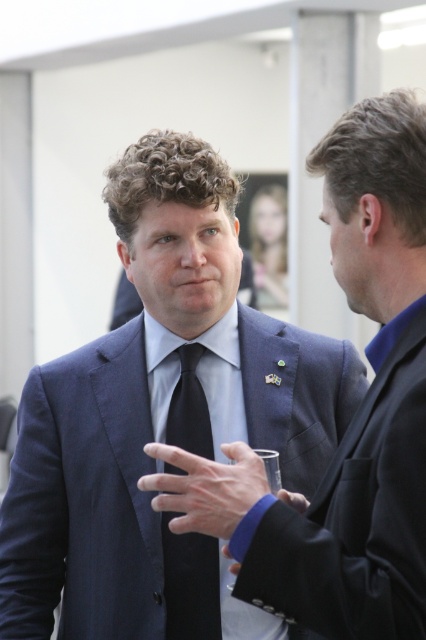
Can you confirm if navy blue fabric suit at center is positioned above black silk tie at center?

Correct, navy blue fabric suit at center is located above black silk tie at center.

Which is above, navy blue fabric suit at center or black silk tie at center?

navy blue fabric suit at center

Is point (417, 557) positioned before point (198, 566)?

That is True.

Locate an element on the screen. This screenshot has height=640, width=426. navy blue fabric suit at center is located at coordinates (354, 515).

Is navy blue suit at center above navy blue fabric suit at center?

Yes, navy blue suit at center is above navy blue fabric suit at center.

Find the location of `navy blue suit at center`. navy blue suit at center is located at coordinates (161, 419).

What are the coordinates of `navy blue suit at center` in the screenshot? It's located at (161, 419).

Which of these two, navy blue suit at center or black silk tie at center, stands shorter?

black silk tie at center

Between point (60, 621) and point (189, 608), which one is positioned in front?

Point (189, 608) is more forward.

What do you see at coordinates (161, 419) in the screenshot? I see `navy blue suit at center` at bounding box center [161, 419].

Locate an element on the screen. navy blue suit at center is located at coordinates (161, 419).